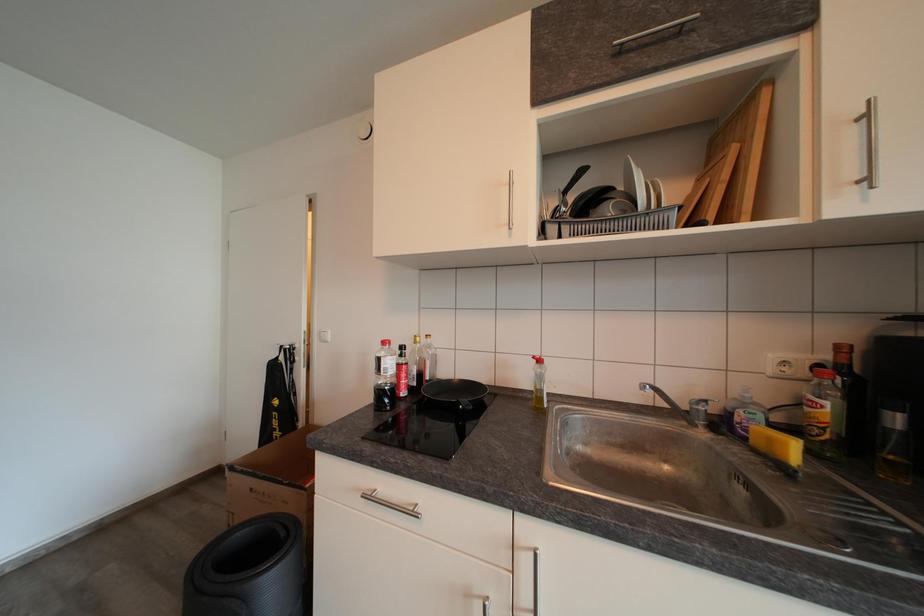
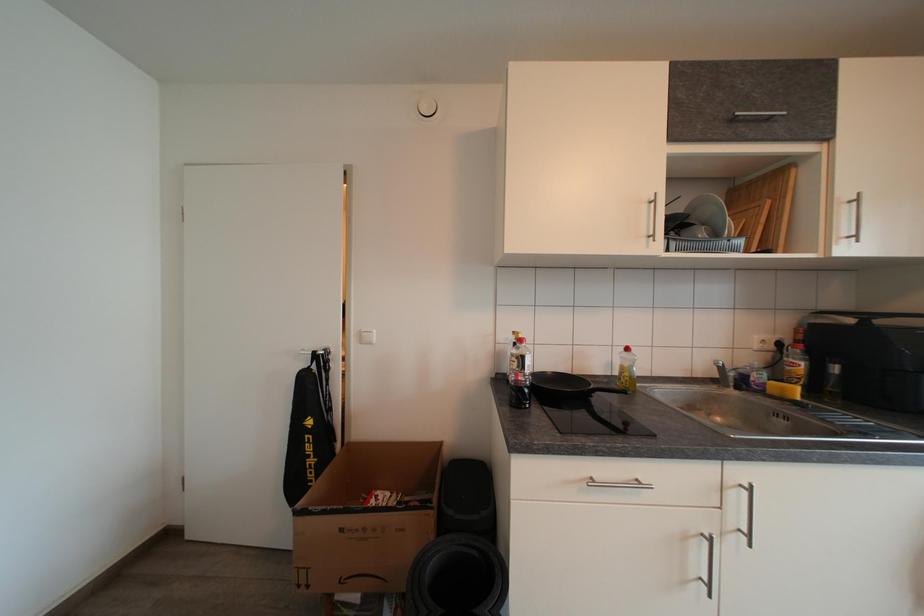
Question: The first image is from the beginning of the video and the second image is from the end. How did the camera likely rotate when shooting the video?

Choices:
 (A) Left
 (B) Right
 (C) Up
 (D) Down

Answer: (B)